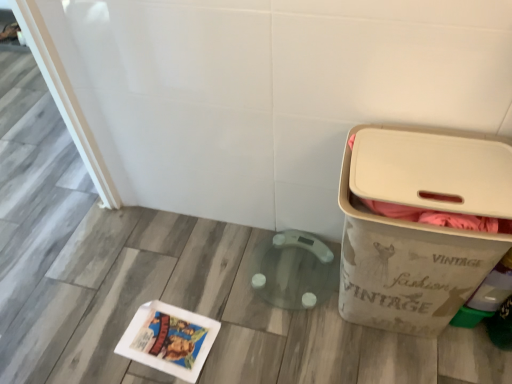
This screenshot has width=512, height=384. What do you see at coordinates (419, 225) in the screenshot?
I see `beige fabric waste container at right` at bounding box center [419, 225].

Measure the distance between point (428, 313) and camera.

Point (428, 313) and camera are 4.11 feet apart.

At what (x,y) coordinates should I click in order to perform the action: click on beige fabric waste container at right. Please return your answer as a coordinate pair (x, y). The height and width of the screenshot is (384, 512). Looking at the image, I should click on (419, 225).

I want to click on beige fabric waste container at right, so coord(419,225).